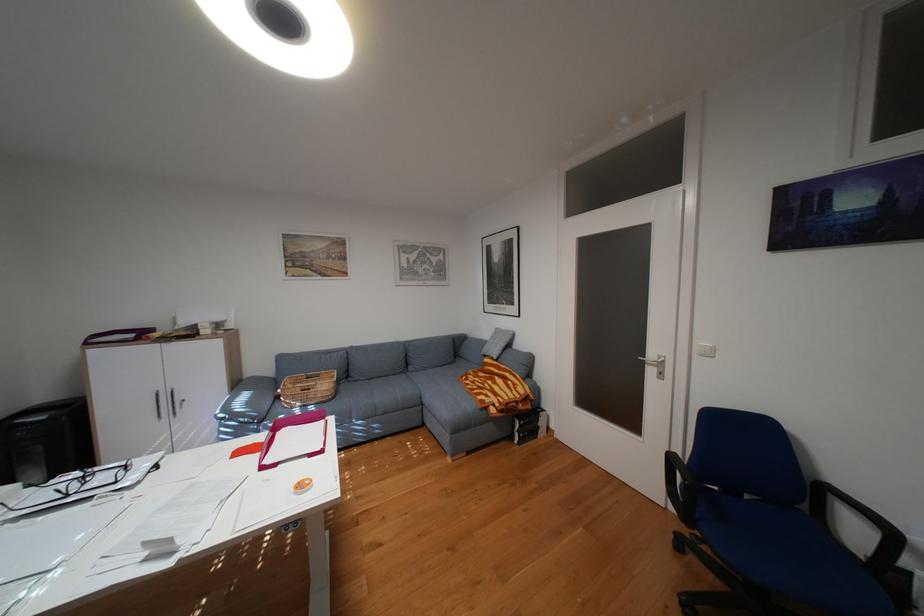
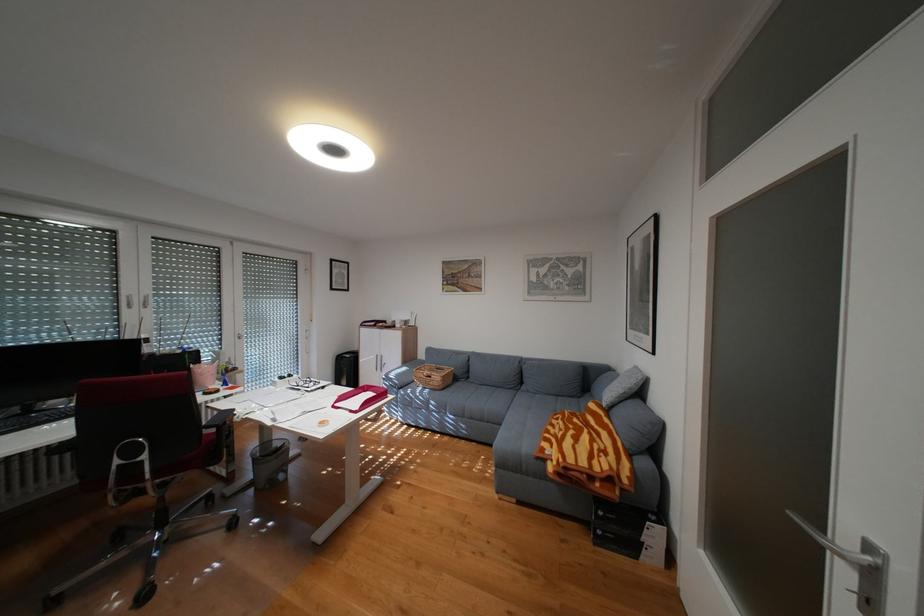
Locate, in the second image, the point that corresponds to (337,385) in the first image.

(450, 377)